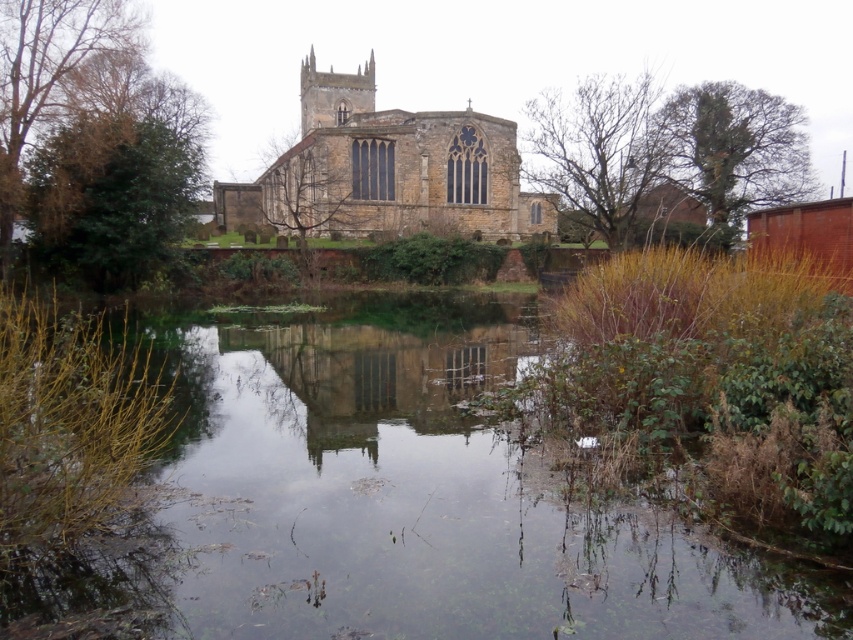
Between brown stone church at center and green leafy tree at upper right, which one is positioned lower?

green leafy tree at upper right is below.

Who is positioned more to the right, brown stone church at center or green leafy tree at upper right?

green leafy tree at upper right

What do you see at coordinates (387, 170) in the screenshot? Image resolution: width=853 pixels, height=640 pixels. I see `brown stone church at center` at bounding box center [387, 170].

Identify the location of brown stone church at center. (387, 170).

Does clear water at center appear on the left side of bare branches at center?

No, clear water at center is not to the left of bare branches at center.

Is clear water at center closer to camera compared to bare branches at center?

Yes.

Image resolution: width=853 pixels, height=640 pixels. In order to click on clear water at center in this screenshot , I will do `click(349, 493)`.

Does point (32, 177) lie in front of point (762, 113)?

Yes.

Is green leafy tree at left smaller than green leafy tree at upper right?

No.

Where is `green leafy tree at left`? Image resolution: width=853 pixels, height=640 pixels. green leafy tree at left is located at coordinates (94, 140).